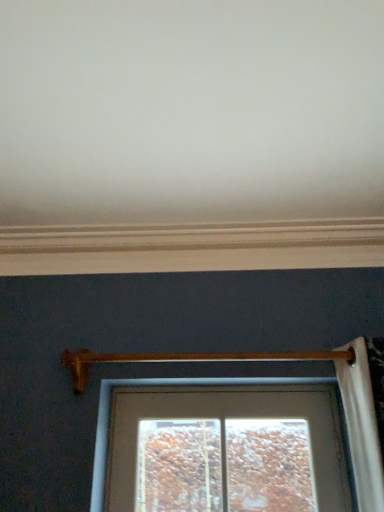
At what (x,y) coordinates should I click in order to perform the action: click on white painted wood at upper center. Please return your answer as a coordinate pair (x, y). The image size is (384, 512). Looking at the image, I should click on (191, 247).

The width and height of the screenshot is (384, 512). Describe the element at coordinates (191, 247) in the screenshot. I see `white painted wood at upper center` at that location.

Locate an element on the screen. This screenshot has width=384, height=512. wooden at center is located at coordinates (188, 359).

The image size is (384, 512). Describe the element at coordinates (188, 359) in the screenshot. I see `wooden at center` at that location.

The image size is (384, 512). I want to click on white painted wood at upper center, so click(191, 247).

Considering the relative positions of wooden at center and white painted wood at upper center in the image provided, is wooden at center to the right of white painted wood at upper center from the viewer's perspective?

Yes, wooden at center is to the right of white painted wood at upper center.

Considering their positions, is wooden at center located in front of or behind white painted wood at upper center?

wooden at center is in front of white painted wood at upper center.

Which point is more forward, (71, 375) or (41, 247)?

The point (71, 375) is closer to the camera.

From the image's perspective, is wooden at center beneath white painted wood at upper center?

Indeed, from the image's perspective, wooden at center is shown beneath white painted wood at upper center.

From a real-world perspective, is wooden at center located higher than white painted wood at upper center?

No, from a real-world perspective, wooden at center is not above white painted wood at upper center.

Which object is thinner, wooden at center or white painted wood at upper center?

Thinner between the two is wooden at center.

Considering the sizes of objects wooden at center and white painted wood at upper center in the image provided, who is shorter, wooden at center or white painted wood at upper center?

white painted wood at upper center is shorter.

Is wooden at center bigger or smaller than white painted wood at upper center?

Considering their sizes, wooden at center takes up less space than white painted wood at upper center.

Is wooden at center inside the boundaries of white painted wood at upper center, or outside?

wooden at center exists outside the volume of white painted wood at upper center.

Would you say wooden at center is a long distance from white painted wood at upper center?

wooden at center is actually quite close to white painted wood at upper center.

Is wooden at center aimed at white painted wood at upper center?

No, wooden at center is not turned towards white painted wood at upper center.

Locate an element on the screen. The height and width of the screenshot is (512, 384). door handle below the white painted wood at upper center (from a real-world perspective) is located at coordinates (188, 359).

In the image, is white painted wood at upper center on the left side or the right side of wooden at center?

white painted wood at upper center is positioned on wooden at center's left side.

Which is behind, white painted wood at upper center or wooden at center?

white painted wood at upper center.

Which is closer, (175, 256) or (337, 354)?

Clearly, point (175, 256) is more distant from the camera than point (337, 354).

From the image's perspective, which is above, white painted wood at upper center or wooden at center?

white painted wood at upper center.

From a real-world perspective, between white painted wood at upper center and wooden at center, who is vertically higher?

white painted wood at upper center, from a real-world perspective.

Does white painted wood at upper center have a lesser width compared to wooden at center?

Incorrect, the width of white painted wood at upper center is not less than that of wooden at center.

Which of these two, white painted wood at upper center or wooden at center, stands taller?

wooden at center.

Is white painted wood at upper center bigger than wooden at center?

Indeed, white painted wood at upper center has a larger size compared to wooden at center.

Is white painted wood at upper center spatially inside wooden at center, or outside of it?

white painted wood at upper center cannot be found inside wooden at center.

Is white painted wood at upper center placed right next to wooden at center?

white painted wood at upper center is not next to wooden at center, and they're not touching.

Is white painted wood at upper center facing towards wooden at center?

No, white painted wood at upper center is not facing towards wooden at center.

At what (x,y) coordinates should I click in order to perform the action: click on window sill positioned vertically above the wooden at center (from a real-world perspective). Please return your answer as a coordinate pair (x, y). Looking at the image, I should click on (191, 247).

The image size is (384, 512). Find the location of `window sill above the wooden at center (from a real-world perspective)`. window sill above the wooden at center (from a real-world perspective) is located at coordinates (191, 247).

Identify the location of window sill lying behind the wooden at center. (191, 247).